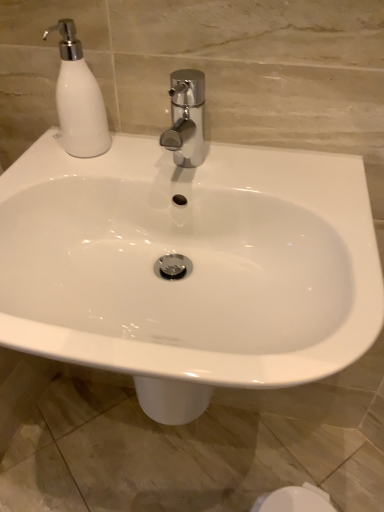
At what (x,y) coordinates should I click in order to perform the action: click on vacant area that is situated to the right of white glossy soap dispenser at upper left. Please return your answer as a coordinate pair (x, y). Image resolution: width=384 pixels, height=512 pixels. Looking at the image, I should click on (167, 158).